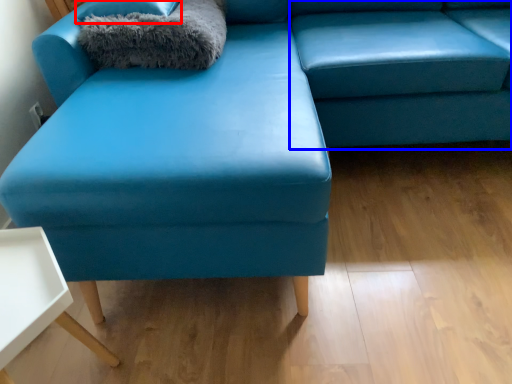
Question: Which point is further to the camera, pillow (highlighted by a red box) or swivel chair (highlighted by a blue box)?

Choices:
 (A) pillow
 (B) swivel chair

Answer: (A)